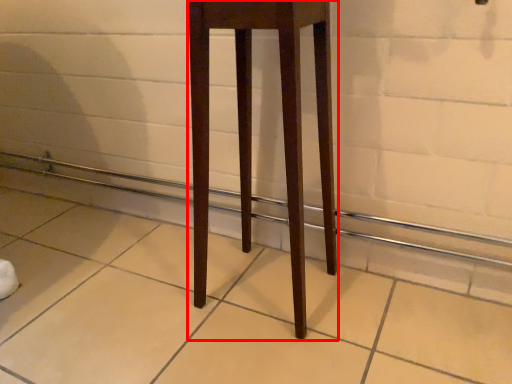
Question: Observing the image, what is the correct spatial positioning of furniture (annotated by the red box) in reference to balustrade?

Choices:
 (A) left
 (B) right

Answer: (B)